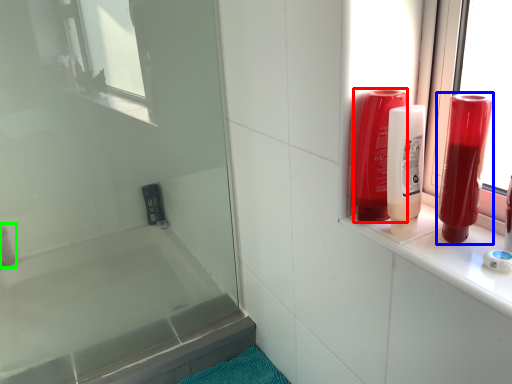
Question: Which object is positioned farthest from mouthwash (highlighted by a red box)? Select from mouthwash (highlighted by a blue box) and toiletry (highlighted by a green box).

Choices:
 (A) mouthwash
 (B) toiletry

Answer: (B)